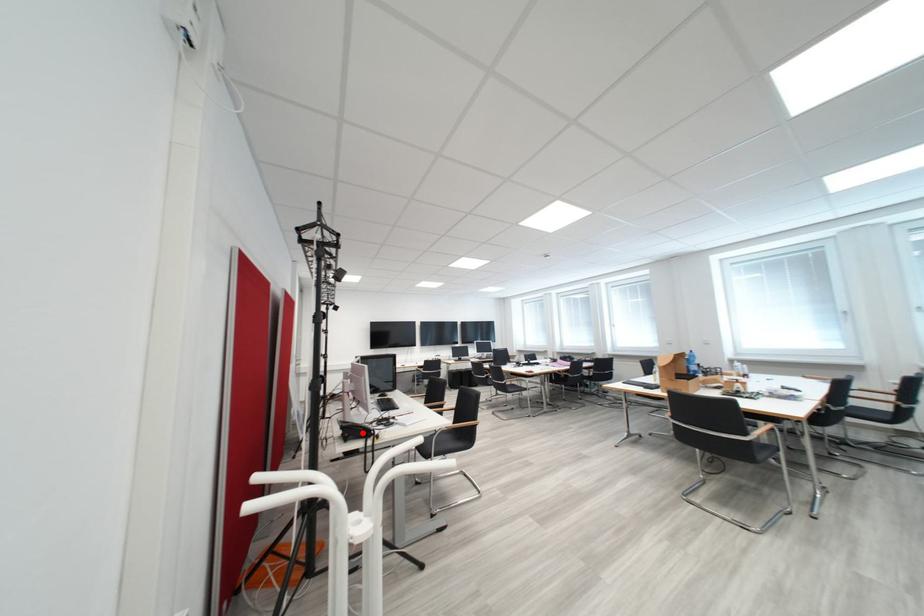
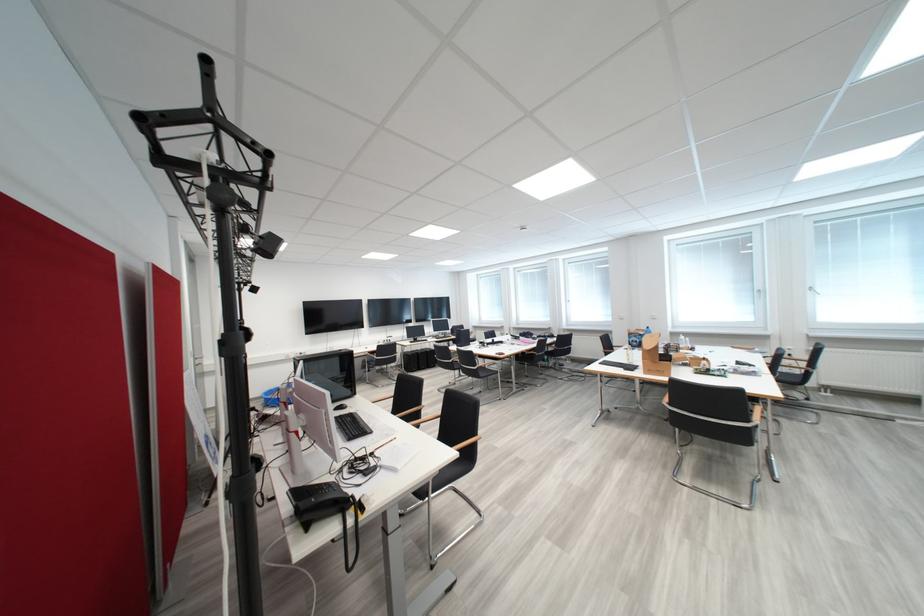
Question: I am providing you with two images of the same scene from different viewpoints. A red point is marked on the first image. Can you still see the location of the red point in image 2?

Choices:
 (A) Yes
 (B) No

Answer: (A)